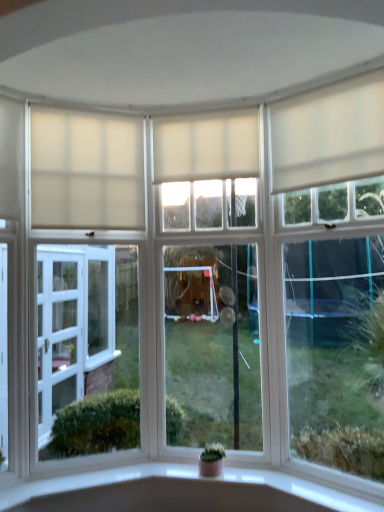
Question: Would you say clear glass window at center, placed as the 2th window when sorted from right to left, is inside or outside green matte houseplant at center?

Choices:
 (A) outside
 (B) inside

Answer: (A)

Question: Based on their positions, is clear glass window at center, placed as the 2th window when sorted from right to left, located to the left or right of green matte houseplant at center?

Choices:
 (A) right
 (B) left

Answer: (A)

Question: Which is farther from the white matte curtain at upper center, the 3th curtain in the right-to-left sequence?

Choices:
 (A) white matte window at right, which is the 1th window in right-to-left order
 (B) white matte curtain at center, which ranks as the 2th curtain in left-to-right order
 (C) clear glass window at center, placed as the 2th window when sorted from right to left
 (D) green matte houseplant at center
 (E) white matte curtain at upper right, the 1th curtain positioned from the right

Answer: (A)

Question: Considering the real-world distances, which object is closest to the green matte houseplant at center?

Choices:
 (A) clear glass window at center, placed as the 2th window when sorted from right to left
 (B) white matte curtain at center, which ranks as the 2th curtain in left-to-right order
 (C) white matte curtain at upper right, the 3th curtain when ordered from left to right
 (D) white matte window at right, which is the 1th window in right-to-left order
 (E) white matte curtain at upper center, which is the first curtain from left to right

Answer: (A)